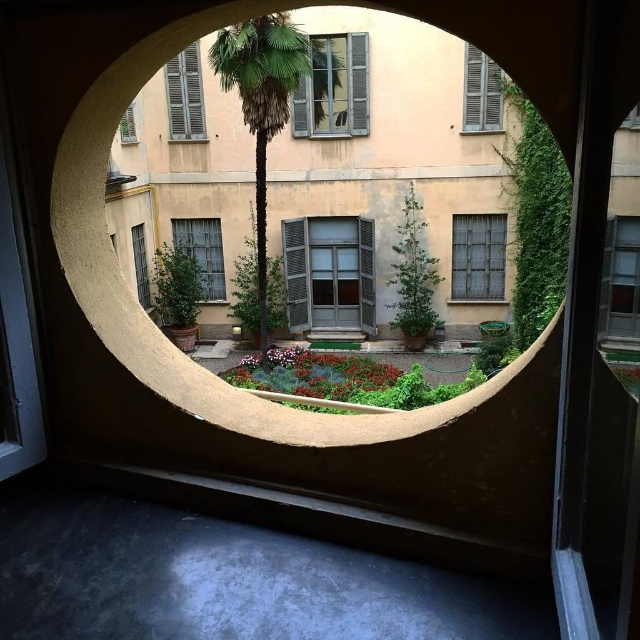
You are an architect designing a new building and want to ensure proper ventilation. You have two windows in the design, the wooden shutters at upper center and the metallic grid window at center. Based on their sizes, which window would allow more airflow when fully open?

The wooden shutters at upper center is much taller than the metallic grid window at center, so when fully open, it would allow more airflow due to its larger size.

From the picture: You are standing in the courtyard and want to place a small potted plant exactly at the point marked as point (x=330, y=273). According to the scene description, what object is currently located at that point?

The wooden shutters at center are located at point (x=330, y=273).

You are standing in the courtyard and want to place a small sculpture between the two points, point (307, 93) and point (465, 253). Which point should you start from to ensure the sculpture is closer to the viewer?

You should start from point (307, 93) because it is closer to the viewer than point (465, 253).